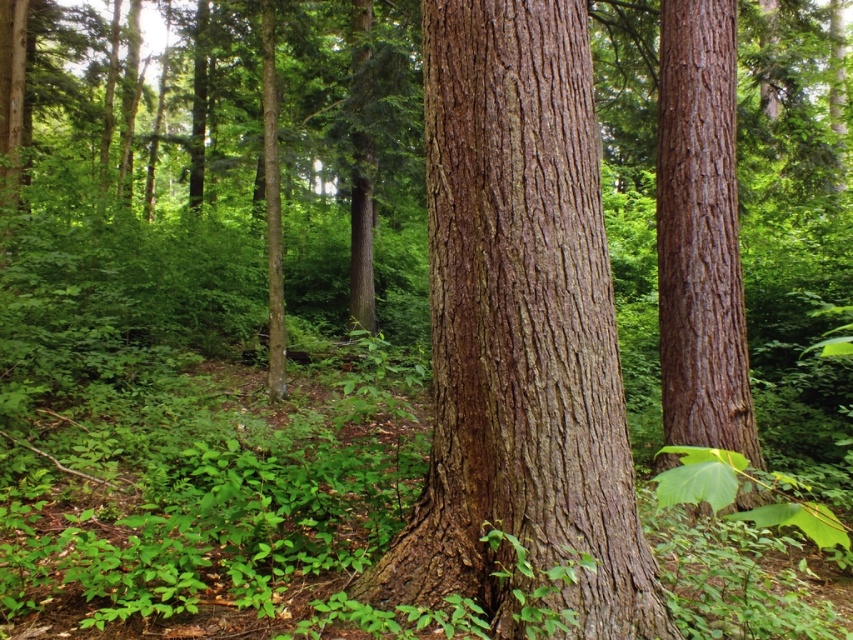
You are a hiker standing in the forest and notice two tree trunks at the center. Which one is closer to the ground, the brown rough bark tree trunk at center or the smooth brown bark at center?

The brown rough bark tree trunk at center is closer to the ground because it is positioned under the smooth brown bark tree trunk at center.

Based on the photo, you are a hiker who wants to place a 3 meter long ladder between the brown rough bark tree trunk at center and the smooth brown bark at center. Can the ladder fit between them?

The distance between the brown rough bark tree trunk at center and the smooth brown bark at center is 2.63 meters. Since the ladder is 3 meters long, it cannot fit between them as the distance is shorter than the ladder.

You are standing in the forest and want to locate the brown rough bark tree trunk at center. According to the coordinates provided, where would you find it?

The brown rough bark tree trunk at center is located at point (520, 332).